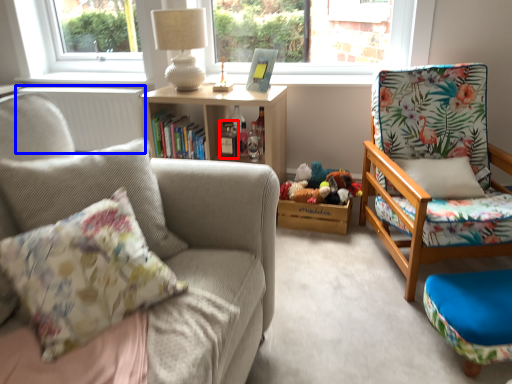
Question: Which object is further to the camera taking this photo, bottle (highlighted by a red box) or radiator (highlighted by a blue box)?

Choices:
 (A) bottle
 (B) radiator

Answer: (B)